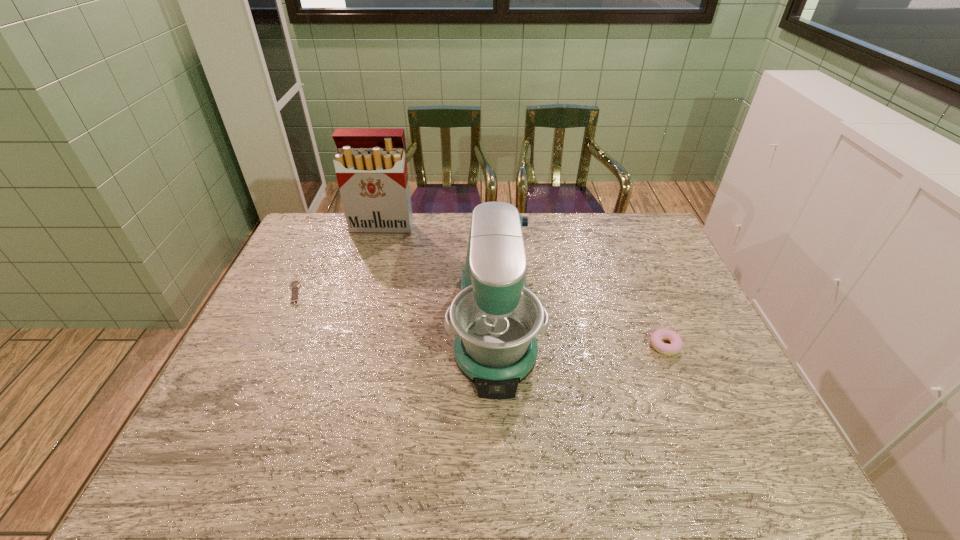
Find the location of a particular element. This screenshot has width=960, height=540. the farthest object is located at coordinates (371, 169).

Where is `the third object from right to left`? The image size is (960, 540). the third object from right to left is located at coordinates (371, 169).

I want to click on the second object from right to left, so click(496, 318).

Find the location of a particular element. The height and width of the screenshot is (540, 960). mixer is located at coordinates (496, 318).

At what (x,y) coordinates should I click in order to perform the action: click on doughnut. Please return your answer as a coordinate pair (x, y). Looking at the image, I should click on [x=657, y=336].

Image resolution: width=960 pixels, height=540 pixels. In order to click on the third tallest object in this screenshot , I will do [657, 336].

Where is `the shortest object`? The width and height of the screenshot is (960, 540). the shortest object is located at coordinates (294, 285).

I want to click on the leftmost object, so click(x=294, y=285).

Identify the location of blank space located 0.130m with the lid open on the third object from right to left. (374, 258).

Locate an element on the screen. vacant point located on the front-facing side of the third object from left to right is located at coordinates coord(499,460).